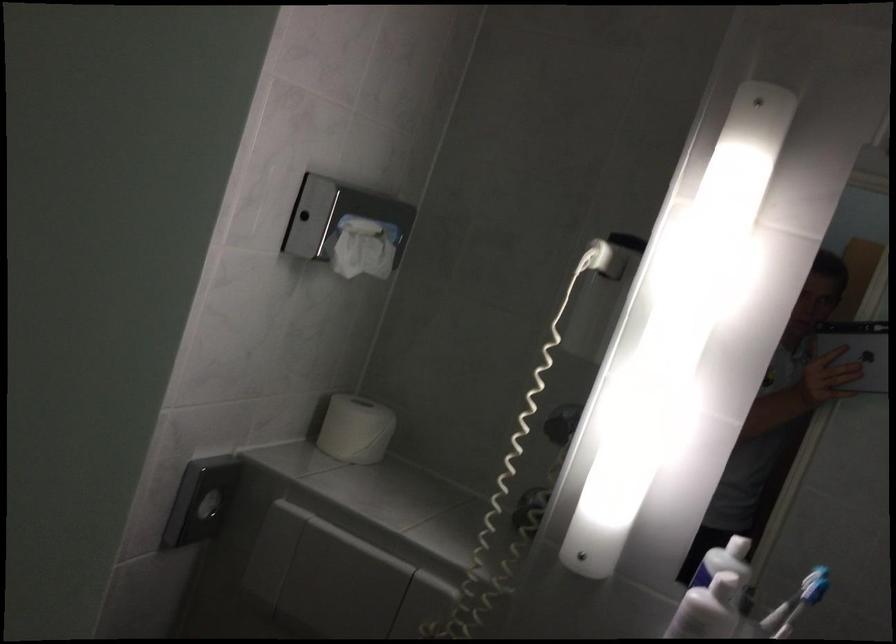
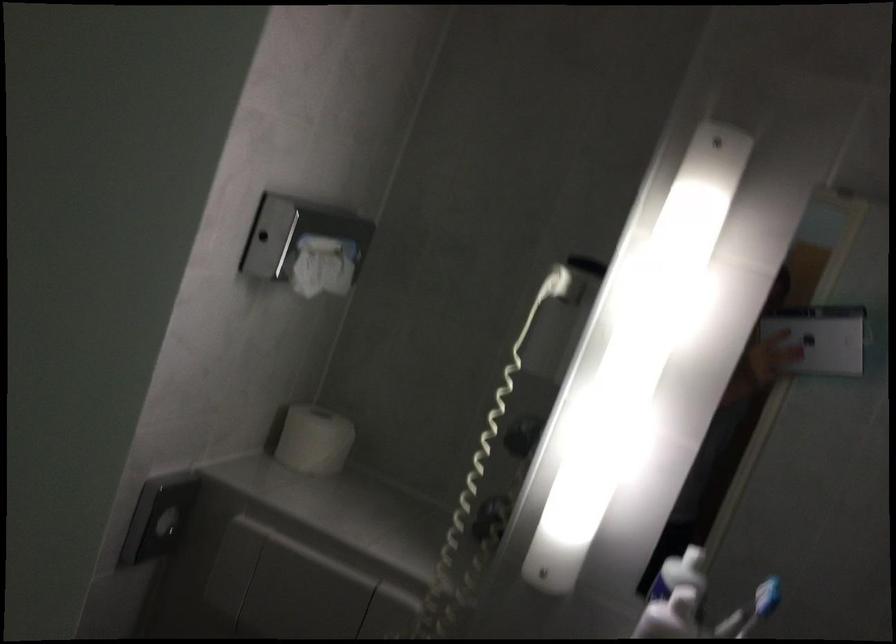
Question: The images are taken continuously from a first-person perspective. In which direction are you moving?

Choices:
 (A) Left
 (B) Right
 (C) Forward
 (D) Backward

Answer: (A)